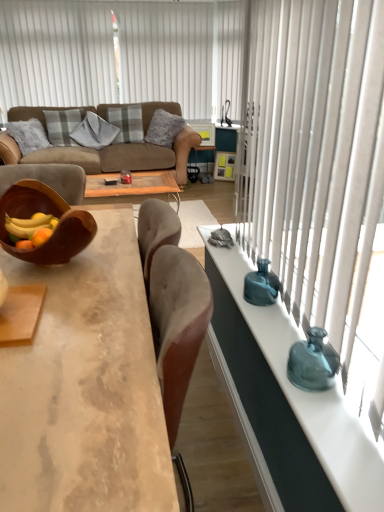
Locate an element on the screen. The image size is (384, 512). vacant space to the right of brown wooden bowl at left is located at coordinates (124, 263).